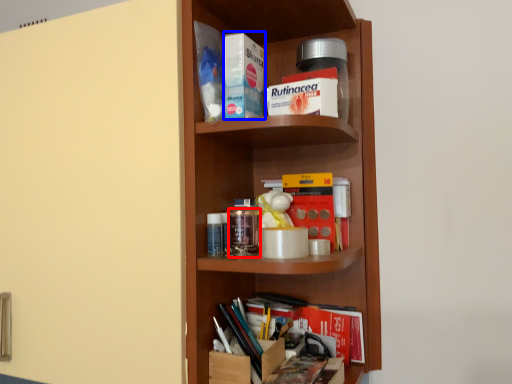
Question: Which object is further to the camera taking this photo, glass jar (highlighted by a red box) or book (highlighted by a blue box)?

Choices:
 (A) glass jar
 (B) book

Answer: (A)